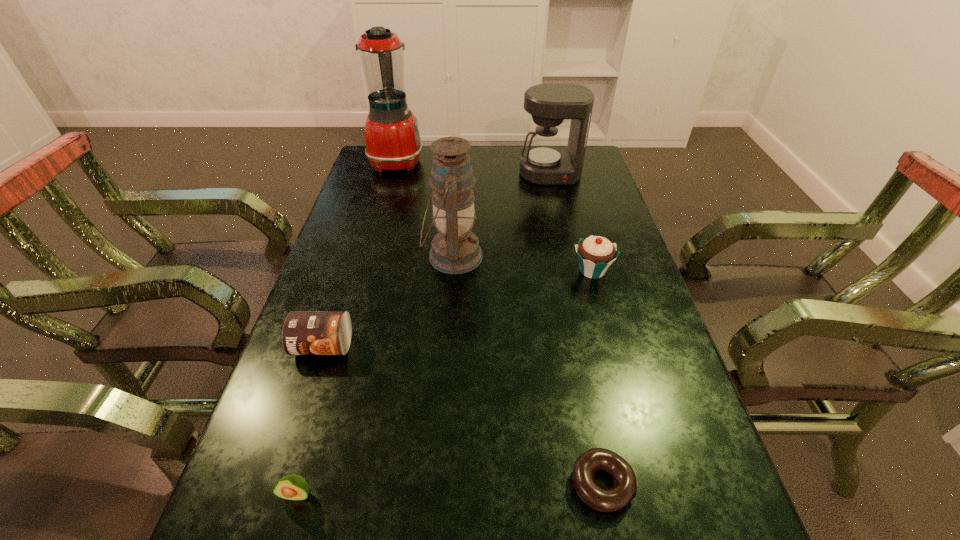
This screenshot has height=540, width=960. In order to click on free spot between the cupcake and the oil lamp in this screenshot , I will do `click(522, 264)`.

Locate an element on the screen. The height and width of the screenshot is (540, 960). free space between the third tallest object and the fourth tallest object is located at coordinates (571, 222).

The image size is (960, 540). In order to click on vacant region between the fourth shortest object and the coffee maker in this screenshot , I will do `click(571, 222)`.

Locate an element on the screen. The width and height of the screenshot is (960, 540). blank region between the fourth object from left to right and the doughnut is located at coordinates (527, 370).

I want to click on free space between the fourth tallest object and the third nearest object, so click(x=458, y=308).

Locate an element on the screen. The height and width of the screenshot is (540, 960). vacant area that lies between the fourth object from right to left and the fourth shortest object is located at coordinates (522, 264).

The image size is (960, 540). I want to click on free area in between the cupcake and the oil lamp, so click(522, 264).

Identify which object is the sixth nearest to the can. Please provide its 2D coordinates. Your answer should be formatted as a tuple, i.e. [(x, y)], where the tuple contains the x and y coordinates of a point satisfying the conditions above.

[(546, 163)]

Find the location of a particular element. The width and height of the screenshot is (960, 540). object that is the third closest to the shortest object is located at coordinates (455, 249).

The width and height of the screenshot is (960, 540). In order to click on vacant area that satisfies the following two spatial constraints: 1. on the back side of the fourth tallest object; 2. on the controls of the food processor in this screenshot , I will do `click(562, 161)`.